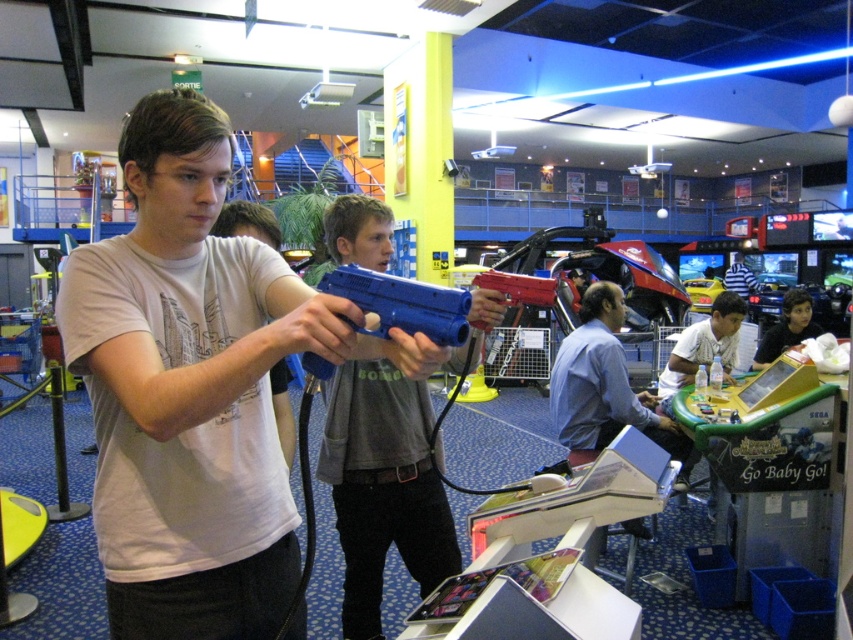
Is blue plastic gun at center positioned behind dark blue shirt at center?

No, blue plastic gun at center is closer to the viewer.

Does point (344, 484) lie behind point (798, 305)?

No, it is in front of (798, 305).

The height and width of the screenshot is (640, 853). I want to click on blue plastic gun at center, so click(x=386, y=480).

Is matte white t-shirt at center bigger than blue shirt at center?

No, matte white t-shirt at center is not bigger than blue shirt at center.

Is matte white t-shirt at center positioned behind blue shirt at center?

No, matte white t-shirt at center is in front of blue shirt at center.

What are the coordinates of `matte white t-shirt at center` in the screenshot? It's located at (189, 388).

This screenshot has height=640, width=853. In order to click on matte white t-shirt at center in this screenshot , I will do `click(189, 388)`.

Can you confirm if blue shirt at center is bigger than dark blue shirt at center?

Yes, blue shirt at center is bigger than dark blue shirt at center.

Is blue shirt at center closer to the viewer compared to dark blue shirt at center?

Yes, it is in front of dark blue shirt at center.

Between point (682, 440) and point (808, 300), which one is positioned behind?

Positioned behind is point (808, 300).

Identify the location of blue shirt at center. Image resolution: width=853 pixels, height=640 pixels. (604, 385).